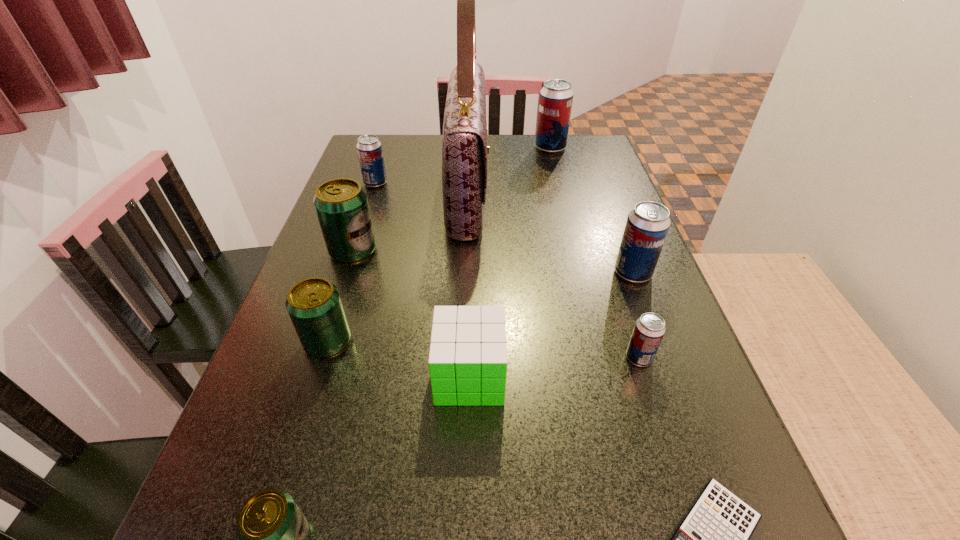
Locate an element on the screen. This screenshot has height=540, width=960. blank space that satisfies the following two spatial constraints: 1. on the front of the cube with the clasp; 2. on the right side of the handbag is located at coordinates (462, 376).

You are a GUI agent. You are given a task and a screenshot of the screen. Output one action in this format:
    pyautogui.click(x=<x>, y=<y>)
    Task: Click on the vacant space that satisfies the following two spatial constraints: 1. on the front of the handbag with the clasp; 2. on the right side of the cube
    
    Given the screenshot: What is the action you would take?
    pyautogui.click(x=462, y=376)

Find the location of `free space that satisfies the following two spatial constraints: 1. on the front of the cube with the clasp; 2. on the left side of the brown handbag`. free space that satisfies the following two spatial constraints: 1. on the front of the cube with the clasp; 2. on the left side of the brown handbag is located at coordinates (462, 376).

Image resolution: width=960 pixels, height=540 pixels. What are the coordinates of `free space that satisfies the following two spatial constraints: 1. on the front of the handbag with the clasp; 2. on the right side of the nearest red beer can` in the screenshot? It's located at (463, 357).